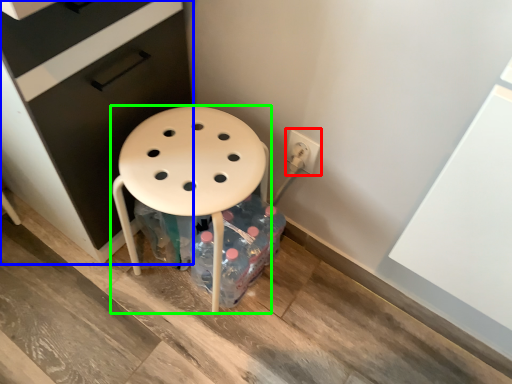
Question: Which is farther away from electric outlet (highlighted by a red box)? file cabinet (highlighted by a blue box) or stool (highlighted by a green box)?

Choices:
 (A) file cabinet
 (B) stool

Answer: (A)